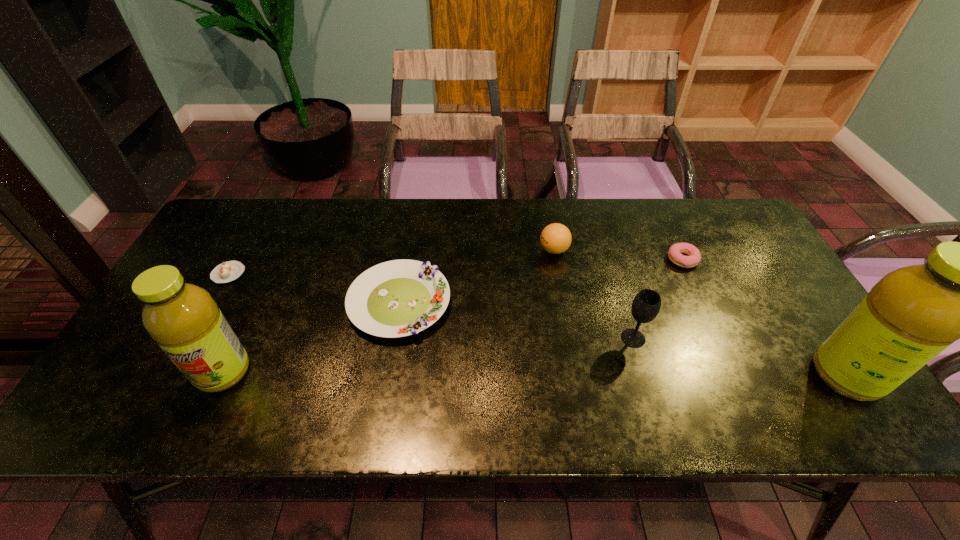
This screenshot has width=960, height=540. Identify the location of object present at the right edge. (912, 314).

You are a GUI agent. You are given a task and a screenshot of the screen. Output one action in this format:
    pyautogui.click(x=<x>, y=<y>)
    Task: Click on the object present at the near right corner
    Image resolution: width=960 pixels, height=540 pixels.
    Given the screenshot: What is the action you would take?
    pyautogui.click(x=912, y=314)

In order to click on vacant space at the far edge in this screenshot , I will do `click(389, 221)`.

Locate an element on the screen. free spot at the near edge of the desktop is located at coordinates (686, 390).

In the image, there is a desktop. Where is `vacant space at the left edge`? The height and width of the screenshot is (540, 960). vacant space at the left edge is located at coordinates (216, 292).

Identify the location of free space at the right edge of the desktop. (713, 262).

At what (x,y) coordinates should I click in order to perform the action: click on vacant space at the far left corner of the desktop. Please return your answer as a coordinate pair (x, y). Looking at the image, I should click on pos(228,222).

Where is `free region at the far right corner of the desktop`? The width and height of the screenshot is (960, 540). free region at the far right corner of the desktop is located at coordinates (718, 231).

Find the location of a particular element. unoccupied position between the fourth shortest object and the doughnut is located at coordinates (618, 255).

At what (x,y) coordinates should I click in order to perform the action: click on empty location between the doughnut and the cupcake. Please return your answer as a coordinate pair (x, y). Image resolution: width=960 pixels, height=540 pixels. Looking at the image, I should click on (456, 267).